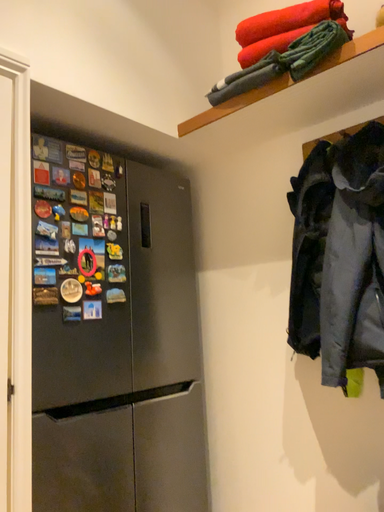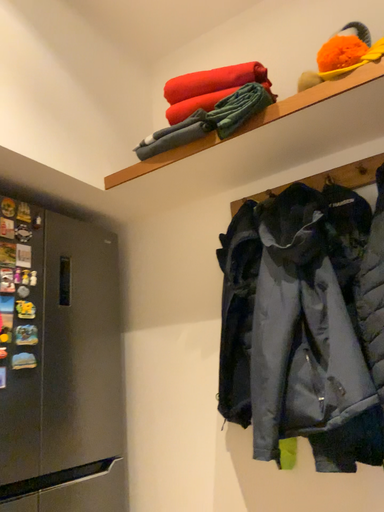
Question: Which way did the camera rotate in the video?

Choices:
 (A) rotated downward
 (B) rotated upward

Answer: (B)